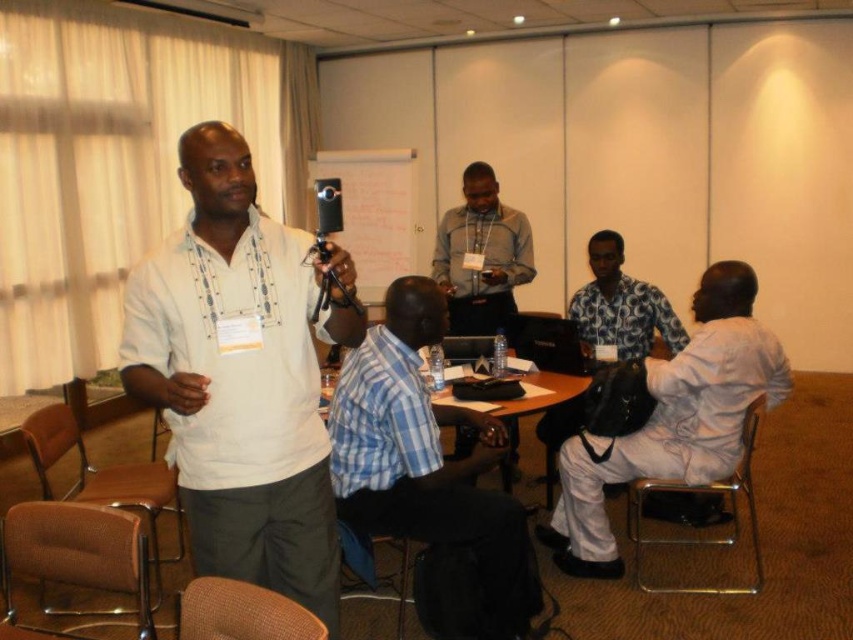
You are a photographer in the conference room. You need to capture both the blue checkered shirt at center and the gray sweater at center in a single frame. Which clothing item will appear bigger in your photo?

The blue checkered shirt at center will appear bigger in the photo because it is larger in size than the gray sweater at center.